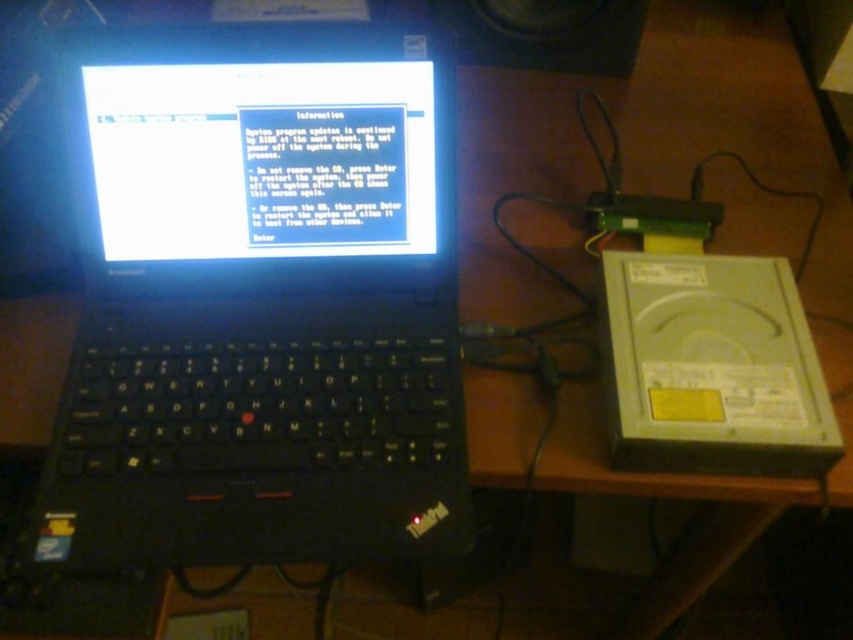
Question: Is black plastic laptop at center smaller than black plastic speaker at upper center?

Choices:
 (A) yes
 (B) no

Answer: (B)

Question: Considering the relative positions of black plastic laptop at center and black plastic speaker at upper center in the image provided, where is black plastic laptop at center located with respect to black plastic speaker at upper center?

Choices:
 (A) right
 (B) left

Answer: (B)

Question: Can you confirm if black plastic laptop at center is thinner than black plastic speaker at upper center?

Choices:
 (A) no
 (B) yes

Answer: (A)

Question: Which object is farther from the camera taking this photo?

Choices:
 (A) black plastic laptop at center
 (B) black plastic speaker at upper center

Answer: (B)